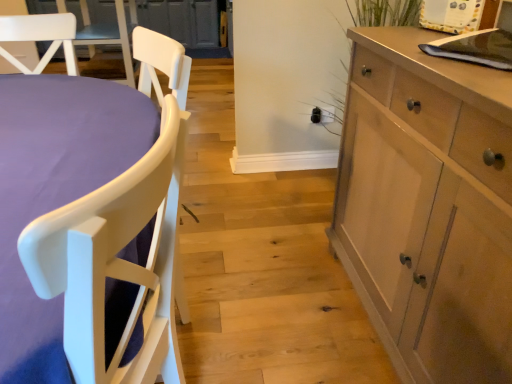
This screenshot has height=384, width=512. Describe the element at coordinates (114, 263) in the screenshot. I see `white matte chair at left` at that location.

The width and height of the screenshot is (512, 384). I want to click on white matte chair at left, so click(114, 263).

Locate an element on the screen. light wood cabinet at right is located at coordinates (428, 206).

What do you see at coordinates (428, 206) in the screenshot? The height and width of the screenshot is (384, 512). I see `light wood cabinet at right` at bounding box center [428, 206].

Identify the location of white matte chair at left. (114, 263).

Visually, is light wood cabinet at right positioned to the left or to the right of white matte chair at left?

Based on their positions, light wood cabinet at right is located to the right of white matte chair at left.

Relative to white matte chair at left, is light wood cabinet at right in front or behind?

In the image, light wood cabinet at right appears behind white matte chair at left.

Looking at this image, which is less distant, (395,295) or (173,179)?

The point (173,179) is more forward.

From the image's perspective, which one is positioned lower, light wood cabinet at right or white matte chair at left?

white matte chair at left appears lower in the image.

From a real-world perspective, which object stands above the other?

From a 3D spatial view, light wood cabinet at right is above.

Can you confirm if light wood cabinet at right is thinner than white matte chair at left?

Yes, light wood cabinet at right is thinner than white matte chair at left.

Who is shorter, light wood cabinet at right or white matte chair at left?

white matte chair at left is shorter.

Is light wood cabinet at right smaller than white matte chair at left?

Indeed, light wood cabinet at right has a smaller size compared to white matte chair at left.

Can white matte chair at left be found inside light wood cabinet at right?

No, white matte chair at left is not surrounded by light wood cabinet at right.

Would you say light wood cabinet at right is a long distance from white matte chair at left?

That's not correct — light wood cabinet at right is a little close to white matte chair at left.

Is light wood cabinet at right facing towards white matte chair at left?

Yes, light wood cabinet at right is turned towards white matte chair at left.

Locate an element on the screen. cabinetry on the right of white matte chair at left is located at coordinates (428, 206).

Does white matte chair at left appear on the left side of light wood cabinet at right?

Indeed, white matte chair at left is positioned on the left side of light wood cabinet at right.

Is white matte chair at left positioned before light wood cabinet at right?

Yes, white matte chair at left is closer to the camera.

Which is closer, (174, 365) or (479, 258)?

The point (479, 258) is more forward.

Based on the photo, from the image's perspective, which one is positioned lower, white matte chair at left or light wood cabinet at right?

white matte chair at left.

From a real-world perspective, between white matte chair at left and light wood cabinet at right, who is vertically lower?

white matte chair at left is physically lower.

Looking at this image, which object is wider, white matte chair at left or light wood cabinet at right?

With larger width is white matte chair at left.

Which of these two, white matte chair at left or light wood cabinet at right, stands taller?

light wood cabinet at right is taller.

In the scene shown: Which of these two, white matte chair at left or light wood cabinet at right, is bigger?

With larger size is white matte chair at left.

From the picture: Is white matte chair at left situated inside light wood cabinet at right or outside?

white matte chair at left cannot be found inside light wood cabinet at right.

Are white matte chair at left and light wood cabinet at right located far from each other?

No.

Is white matte chair at left facing towards light wood cabinet at right?

No.

Can you tell me how much white matte chair at left and light wood cabinet at right differ in facing direction?

white matte chair at left and light wood cabinet at right are facing 90.5 degrees away from each other.

The height and width of the screenshot is (384, 512). Identify the location of cabinetry above the white matte chair at left (from a real-world perspective). (428, 206).

At what (x,y) coordinates should I click in order to perform the action: click on chair in front of the light wood cabinet at right. Please return your answer as a coordinate pair (x, y). The height and width of the screenshot is (384, 512). Looking at the image, I should click on (114, 263).

Identify the location of cabinetry on the right of white matte chair at left. (428, 206).